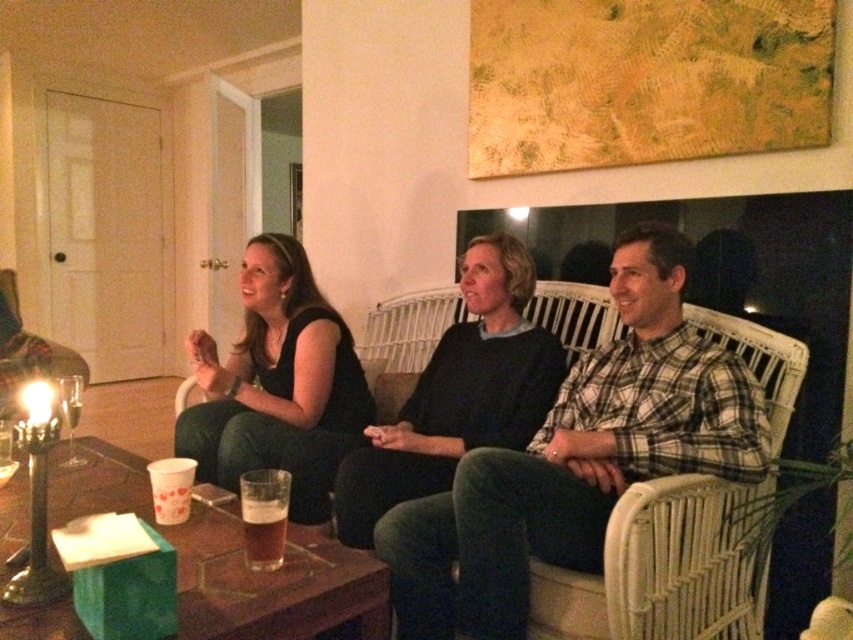
Question: Which of these objects is positioned closest to the dark gray sweater at center?

Choices:
 (A) translucent glass beer at center
 (B) black matte dress at center

Answer: (B)

Question: Which object is farther from the camera taking this photo?

Choices:
 (A) plaid cotton shirt at center
 (B) black matte dress at center
 (C) wooden table at center
 (D) dark gray sweater at center

Answer: (B)

Question: Based on their relative distances, which object is nearer to the black matte dress at center?

Choices:
 (A) dark gray sweater at center
 (B) wooden table at center
 (C) plaid cotton shirt at center
 (D) translucent glass beer at center

Answer: (A)

Question: Does black matte dress at center appear on the right side of translucent glass beer at center?

Choices:
 (A) no
 (B) yes

Answer: (A)

Question: Does plaid cotton shirt at center appear under dark gray sweater at center?

Choices:
 (A) no
 (B) yes

Answer: (B)

Question: Can you confirm if plaid cotton shirt at center is wider than dark gray sweater at center?

Choices:
 (A) yes
 (B) no

Answer: (A)